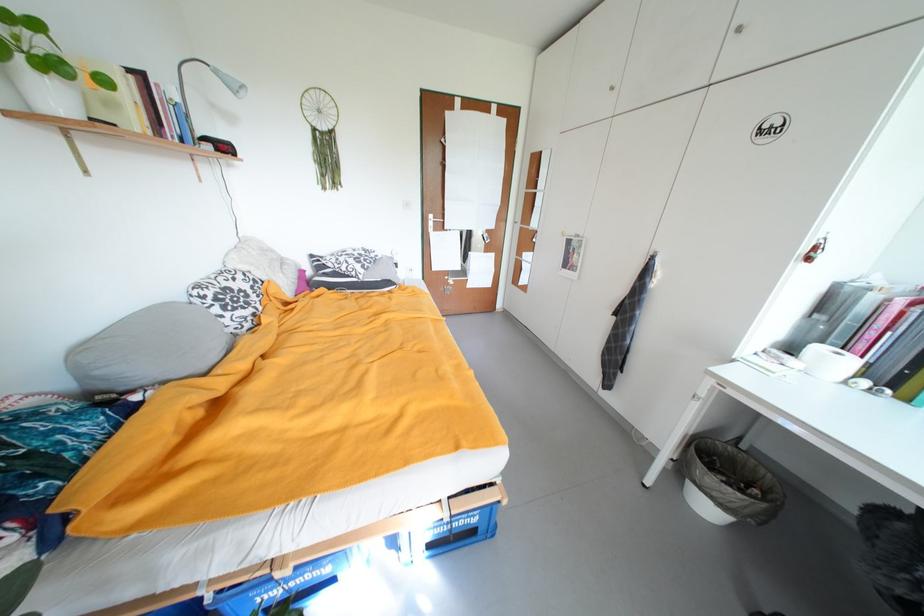
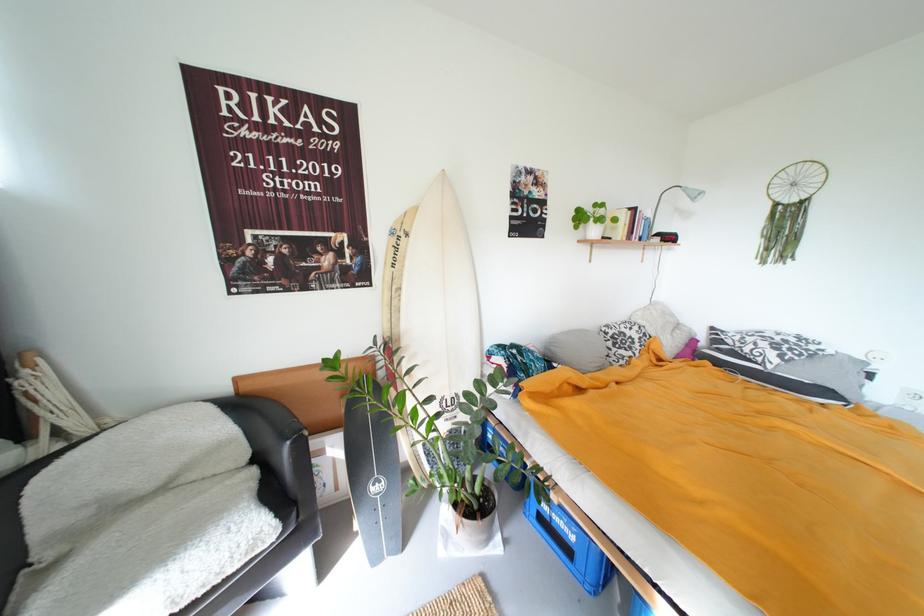
In the second image, find the point that corresponds to (105,374) in the first image.

(560, 350)